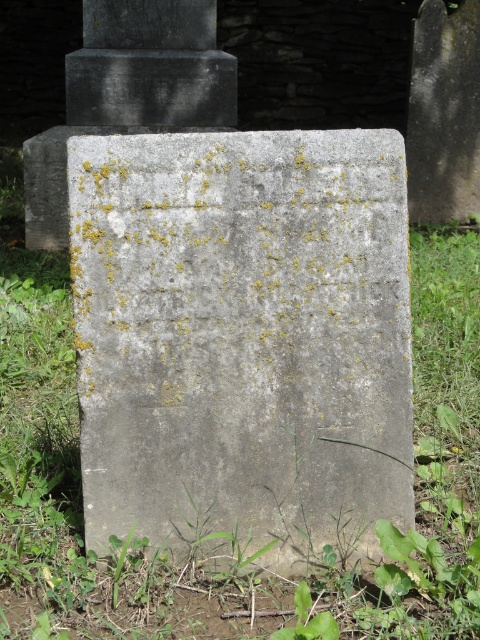
You are a gardener who needs to remove the green leafy weed at lower center without touching the gray stone gravestone at center. What is the minimum distance you must maintain between the weed and the gravestone during removal?

The gray stone gravestone at center is 22.46 inches away from the green leafy weed at lower center. Therefore, the minimum distance you must maintain between the weed and the gravestone during removal is 22.46 inches.

You are a gardener trying to maintain the cemetery. You notice the gray stone gravestone at center and the green leafy weed at lower center. Which object is wider?

The gray stone gravestone at center is wider than the green leafy weed at lower center.